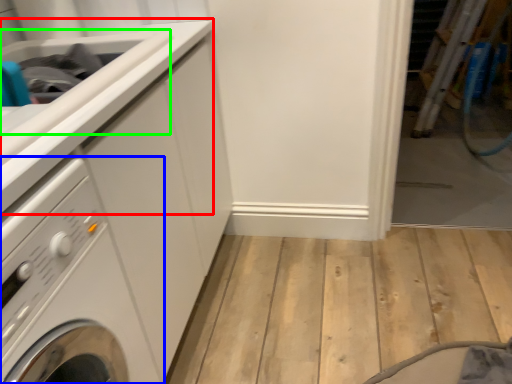
Question: Considering the real-world distances, which object is farthest from counter top (highlighted by a red box)? washing machine (highlighted by a blue box) or sink (highlighted by a green box)?

Choices:
 (A) washing machine
 (B) sink

Answer: (A)